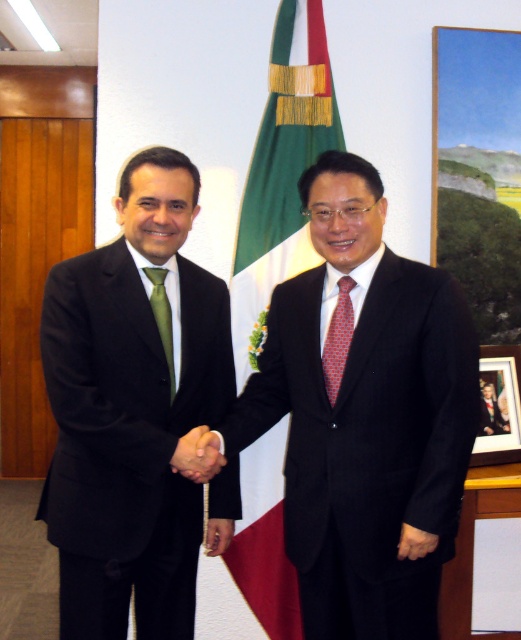
You are standing in front of the scene and want to know the distance of the point marked at coordinates point (167, 435). Can you tell me how far it is from your current position?

The point marked at coordinates point (167, 435) is 1.66 meters away from the camera, so it is 1.66 meters away from your current position.

You are a photographer standing in front of the scene. You want to take a photo of both the green fabric flag at center and the green silk tie at center. The camera you are using has a minimum focus distance of 25 inches. Will both objects be in focus?

The green fabric flag at center is 25.48 inches away from the green silk tie at center. Since the camera requires a minimum focus distance of 25 inches, the distance between them is just over the threshold, so both objects should be in focus.